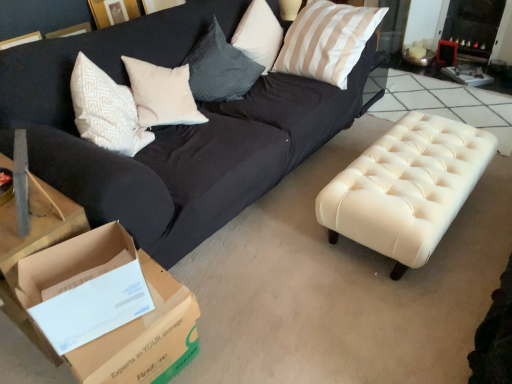
Measure the distance between point (429, 117) and camera.

A distance of 7.83 feet exists between point (429, 117) and camera.

Image resolution: width=512 pixels, height=384 pixels. What do you see at coordinates (327, 41) in the screenshot?
I see `silky beige pillow at upper right` at bounding box center [327, 41].

Image resolution: width=512 pixels, height=384 pixels. What do you see at coordinates (125, 324) in the screenshot?
I see `brown cardboard box at lower left` at bounding box center [125, 324].

At what (x,y) coordinates should I click in order to perform the action: click on creamy leather ottoman at center. Please return your answer as a coordinate pair (x, y). Image resolution: width=512 pixels, height=384 pixels. Looking at the image, I should click on (406, 188).

From the image's perspective, who appears lower, creamy leather ottoman at center or brown cardboard box at lower left?

brown cardboard box at lower left appears lower in the image.

Can you confirm if creamy leather ottoman at center is shorter than brown cardboard box at lower left?

Incorrect, the height of creamy leather ottoman at center does not fall short of that of brown cardboard box at lower left.

Is brown cardboard box at lower left inside creamy leather ottoman at center?

No, brown cardboard box at lower left is not inside creamy leather ottoman at center.

Does creamy leather ottoman at center come in front of brown cardboard box at lower left?

No, creamy leather ottoman at center is further to the viewer.

Considering the sizes of objects brown cardboard box at lower left and creamy leather ottoman at center in the image provided, who is bigger, brown cardboard box at lower left or creamy leather ottoman at center?

Bigger between the two is creamy leather ottoman at center.

Can you confirm if brown cardboard box at lower left is shorter than creamy leather ottoman at center?

Indeed, brown cardboard box at lower left has a lesser height compared to creamy leather ottoman at center.

Is brown cardboard box at lower left thinner than creamy leather ottoman at center?

Yes, brown cardboard box at lower left is thinner than creamy leather ottoman at center.

Where is `pillow above the creamy leather ottoman at center (from a real-world perspective)`? pillow above the creamy leather ottoman at center (from a real-world perspective) is located at coordinates (327, 41).

Is creamy leather ottoman at center outside of silky beige pillow at upper right?

That's correct, creamy leather ottoman at center is outside of silky beige pillow at upper right.

Considering the sizes of creamy leather ottoman at center and silky beige pillow at upper right in the image, is creamy leather ottoman at center wider or thinner than silky beige pillow at upper right?

Clearly, creamy leather ottoman at center has more width compared to silky beige pillow at upper right.

From a real-world perspective, relative to silky beige pillow at upper right, is creamy leather ottoman at center vertically above or below?

Clearly, from a real-world perspective, creamy leather ottoman at center is below silky beige pillow at upper right.

Which of these two, silky beige pillow at upper right or brown cardboard box at lower left, stands shorter?

brown cardboard box at lower left.

How many degrees apart are the facing directions of silky beige pillow at upper right and brown cardboard box at lower left?

The facing directions of silky beige pillow at upper right and brown cardboard box at lower left are 94.9 degrees apart.

Which object is wider, silky beige pillow at upper right or brown cardboard box at lower left?

With larger width is silky beige pillow at upper right.

Is point (295, 69) closer or farther from the camera than point (156, 270)?

Point (295, 69) appears to be farther away from the viewer than point (156, 270).

Is silky beige pillow at upper right oriented away from creamy leather ottoman at center?

No, silky beige pillow at upper right is not facing the opposite direction of creamy leather ottoman at center.

Which point is more distant from viewer, (348, 32) or (420, 171)?

Positioned behind is point (348, 32).

Is silky beige pillow at upper right taller than creamy leather ottoman at center?

Indeed, silky beige pillow at upper right has a greater height compared to creamy leather ottoman at center.

Looking at this image, which object is wider, brown cardboard box at lower left or silky beige pillow at upper right?

Wider between the two is silky beige pillow at upper right.

Is brown cardboard box at lower left shorter than silky beige pillow at upper right?

Indeed, brown cardboard box at lower left has a lesser height compared to silky beige pillow at upper right.

What's the angular difference between brown cardboard box at lower left and silky beige pillow at upper right's facing directions?

They differ by 94.9 degrees in their facing directions.

Is brown cardboard box at lower left inside the boundaries of silky beige pillow at upper right, or outside?

brown cardboard box at lower left is spatially situated outside silky beige pillow at upper right.

The width and height of the screenshot is (512, 384). Identify the location of cardboard box lying below the creamy leather ottoman at center (from the image's perspective). 125,324.

The image size is (512, 384). Find the location of `table that appears on the right of brown cardboard box at lower left`. table that appears on the right of brown cardboard box at lower left is located at coordinates (406, 188).

Considering their positions, is brown cardboard box at lower left positioned further to creamy leather ottoman at center than silky beige pillow at upper right?

brown cardboard box at lower left.

Considering their positions, is silky beige pillow at upper right positioned closer to brown cardboard box at lower left than creamy leather ottoman at center?

creamy leather ottoman at center is positioned closer to the anchor brown cardboard box at lower left.

When comparing their distances from silky beige pillow at upper right, does creamy leather ottoman at center or brown cardboard box at lower left seem closer?

Among the two, creamy leather ottoman at center is located nearer to silky beige pillow at upper right.

Looking at the image, which one is located closer to brown cardboard box at lower left, creamy leather ottoman at center or silky beige pillow at upper right?

The object closer to brown cardboard box at lower left is creamy leather ottoman at center.

Which object lies further to the anchor point creamy leather ottoman at center, silky beige pillow at upper right or brown cardboard box at lower left?

brown cardboard box at lower left is further to creamy leather ottoman at center.

Which object lies nearer to the anchor point silky beige pillow at upper right, brown cardboard box at lower left or creamy leather ottoman at center?

creamy leather ottoman at center.

Locate an element on the screen. This screenshot has width=512, height=384. table that lies between silky beige pillow at upper right and brown cardboard box at lower left from top to bottom is located at coordinates (406, 188).